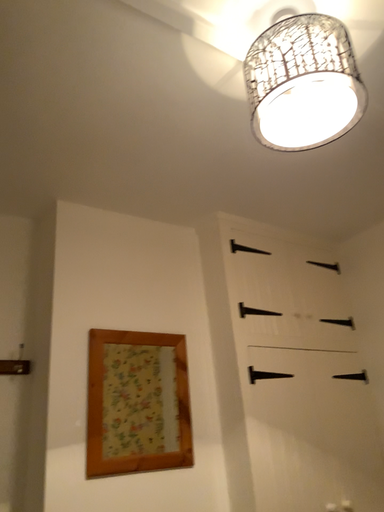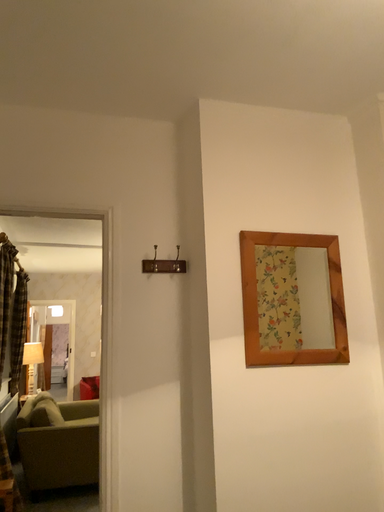
Question: Which way did the camera rotate in the video?

Choices:
 (A) rotated upward
 (B) rotated downward

Answer: (B)